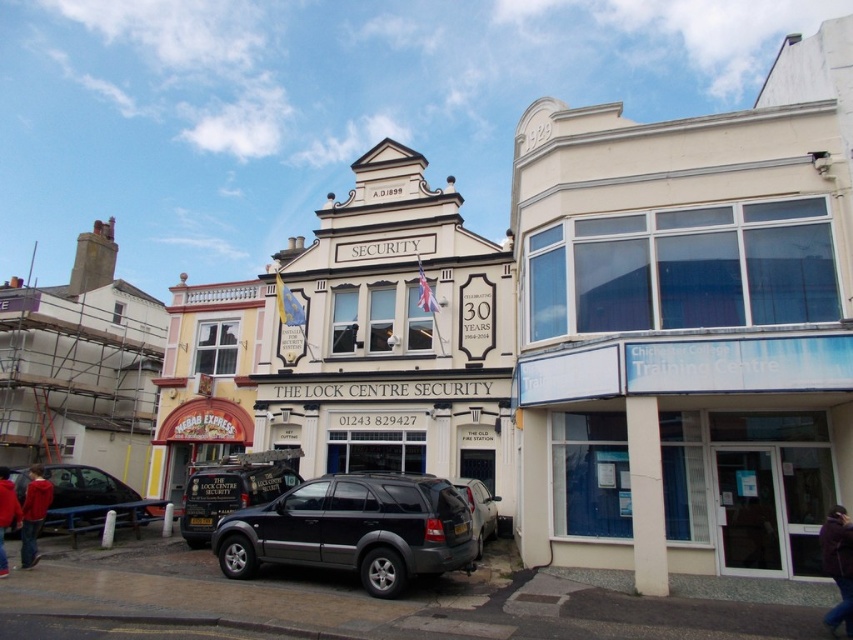
Question: Is shiny black car at lower left further to the viewer compared to red fabric jacket at lower left?

Choices:
 (A) no
 (B) yes

Answer: (B)

Question: Which of the following is the farthest from the observer?

Choices:
 (A) (36, 483)
 (B) (488, 497)
 (C) (15, 516)

Answer: (B)

Question: Which object is positioned closest to the red fleece jacket at lower left?

Choices:
 (A) shiny black car at lower left
 (B) red fabric jacket at lower left

Answer: (B)

Question: Observing the image, what is the correct spatial positioning of dark brown leather jacket at lower right in reference to metallic gray suv at center?

Choices:
 (A) below
 (B) above

Answer: (B)

Question: Considering the relative positions of black matte suv at center and shiny black car at lower left in the image provided, where is black matte suv at center located with respect to shiny black car at lower left?

Choices:
 (A) above
 (B) below

Answer: (A)

Question: Which point is closer to the camera?

Choices:
 (A) (41, 484)
 (B) (80, 502)
 (C) (254, 540)

Answer: (C)